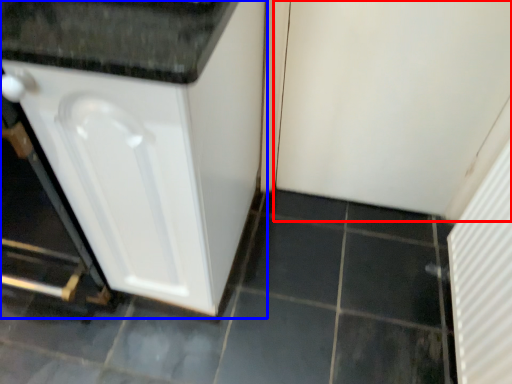
Question: Which object appears farthest to the camera in this image, screen door (highlighted by a red box) or cabinetry (highlighted by a blue box)?

Choices:
 (A) screen door
 (B) cabinetry

Answer: (A)